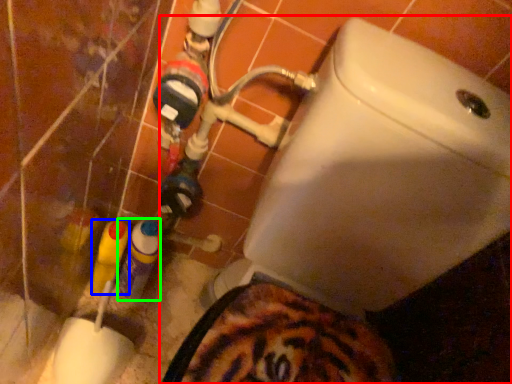
Question: Which object is the closest to the toilet (highlighted by a red box)? Choose among these: bottle (highlighted by a blue box) or bottle (highlighted by a green box).

Choices:
 (A) bottle
 (B) bottle

Answer: (B)